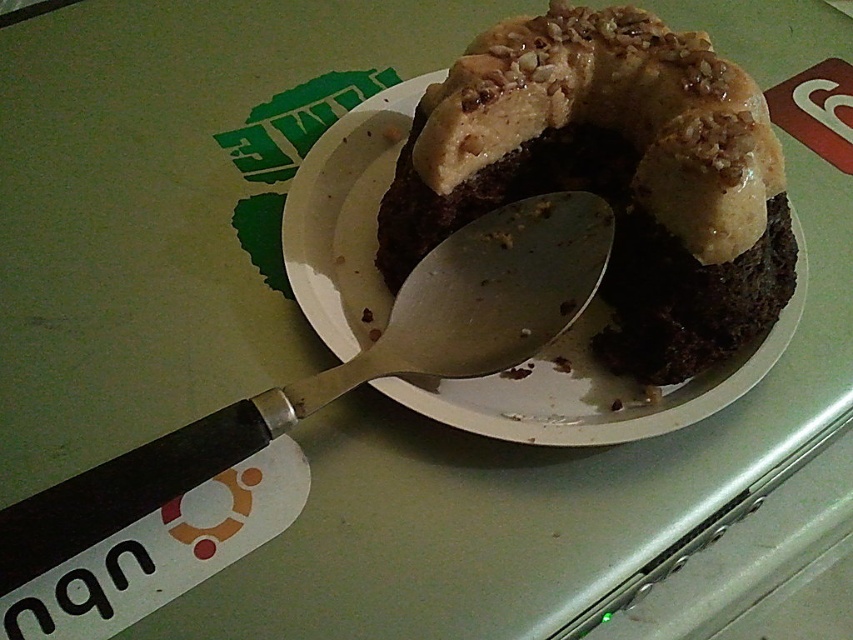
Question: Is chocolatesmoothcake at center bigger than black plastic spoon at upper left?

Choices:
 (A) no
 (B) yes

Answer: (A)

Question: Which point appears closest to the camera in this image?

Choices:
 (A) (535, 330)
 (B) (689, 65)

Answer: (B)

Question: Which object appears farthest from the camera in this image?

Choices:
 (A) chocolatesmoothcake at center
 (B) black plastic spoon at upper left

Answer: (A)

Question: Does chocolatesmoothcake at center appear over black plastic spoon at upper left?

Choices:
 (A) no
 (B) yes

Answer: (B)

Question: Is chocolatesmoothcake at center positioned in front of black plastic spoon at upper left?

Choices:
 (A) no
 (B) yes

Answer: (A)